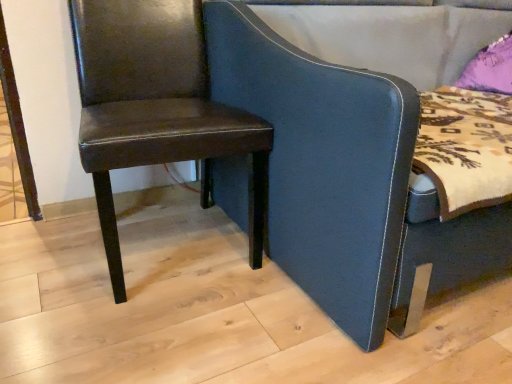
Question: From the image's perspective, is matte brown leather chair at left, acting as the 2th chair starting from the right, over dark blue leather chair at center, the 2th chair in the left-to-right sequence?

Choices:
 (A) no
 (B) yes

Answer: (A)

Question: Is matte brown leather chair at left, acting as the 2th chair starting from the right, closer to camera compared to dark blue leather chair at center, which is the 1th chair in right-to-left order?

Choices:
 (A) no
 (B) yes

Answer: (A)

Question: From a real-world perspective, is matte brown leather chair at left, acting as the 2th chair starting from the right, on dark blue leather chair at center, the 2th chair in the left-to-right sequence?

Choices:
 (A) no
 (B) yes

Answer: (A)

Question: Is matte brown leather chair at left, placed as the 1th chair when sorted from left to right, further to the viewer compared to dark blue leather chair at center, which is the 1th chair in right-to-left order?

Choices:
 (A) no
 (B) yes

Answer: (B)

Question: Can you confirm if matte brown leather chair at left, acting as the 2th chair starting from the right, is smaller than dark blue leather chair at center, which is the 1th chair in right-to-left order?

Choices:
 (A) yes
 (B) no

Answer: (A)

Question: Does matte brown leather chair at left, acting as the 2th chair starting from the right, have a greater width compared to dark blue leather chair at center, the 2th chair in the left-to-right sequence?

Choices:
 (A) no
 (B) yes

Answer: (A)

Question: Does dark blue leather chair at center, which is the 1th chair in right-to-left order, appear on the left side of matte brown leather chair at left, acting as the 2th chair starting from the right?

Choices:
 (A) no
 (B) yes

Answer: (A)

Question: Can you confirm if dark blue leather chair at center, which is the 1th chair in right-to-left order, is taller than matte brown leather chair at left, placed as the 1th chair when sorted from left to right?

Choices:
 (A) yes
 (B) no

Answer: (A)

Question: From a real-world perspective, is dark blue leather chair at center, which is the 1th chair in right-to-left order, on matte brown leather chair at left, acting as the 2th chair starting from the right?

Choices:
 (A) yes
 (B) no

Answer: (A)

Question: From the image's perspective, is dark blue leather chair at center, the 2th chair in the left-to-right sequence, located above matte brown leather chair at left, acting as the 2th chair starting from the right?

Choices:
 (A) yes
 (B) no

Answer: (A)

Question: Does dark blue leather chair at center, the 2th chair in the left-to-right sequence, have a greater width compared to matte brown leather chair at left, acting as the 2th chair starting from the right?

Choices:
 (A) no
 (B) yes

Answer: (B)

Question: From the image's perspective, is dark blue leather chair at center, which is the 1th chair in right-to-left order, under matte brown leather chair at left, placed as the 1th chair when sorted from left to right?

Choices:
 (A) no
 (B) yes

Answer: (A)

Question: From a real-world perspective, is matte brown leather chair at left, placed as the 1th chair when sorted from left to right, positioned above or below dark blue leather chair at center, which is the 1th chair in right-to-left order?

Choices:
 (A) below
 (B) above

Answer: (A)